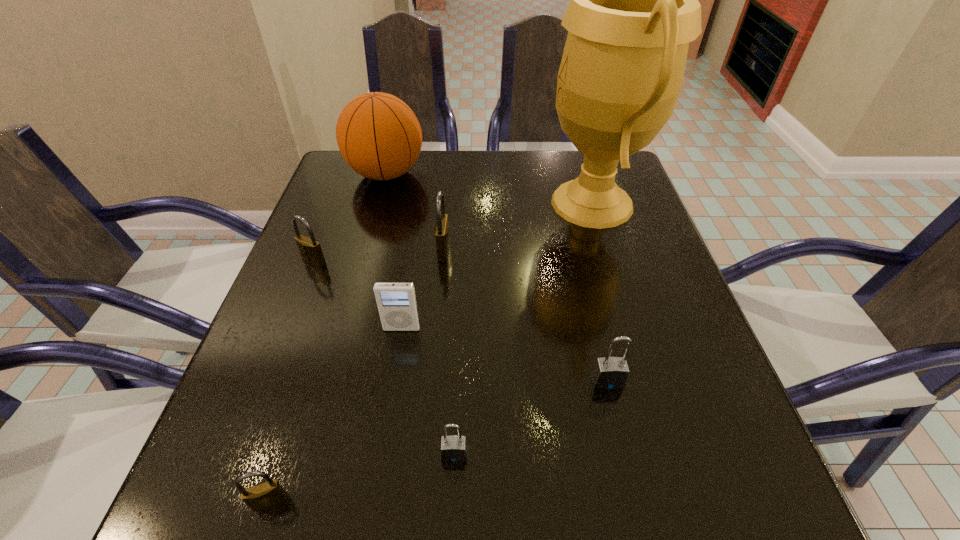
At what (x,y) coordinates should I click in order to perform the action: click on the tallest object. Please return your answer as a coordinate pair (x, y). This screenshot has width=960, height=540. Looking at the image, I should click on (634, 8).

The width and height of the screenshot is (960, 540). I want to click on the seventh shortest object, so click(378, 135).

Where is `orange basketball`? The image size is (960, 540). orange basketball is located at coordinates (378, 135).

This screenshot has width=960, height=540. Identify the location of the third tallest object. (442, 239).

Find the location of `the tallest padlock`. the tallest padlock is located at coordinates (442, 239).

Image resolution: width=960 pixels, height=540 pixels. What are the coordinates of `the third nearest object` in the screenshot? It's located at (609, 373).

Find the location of a particular element. the farther gray padlock is located at coordinates (609, 373).

The image size is (960, 540). I want to click on the leftmost padlock, so click(x=310, y=250).

This screenshot has height=540, width=960. Identify the location of the second smallest brass padlock. (310, 250).

Where is `the fourth nearest object`? the fourth nearest object is located at coordinates (396, 301).